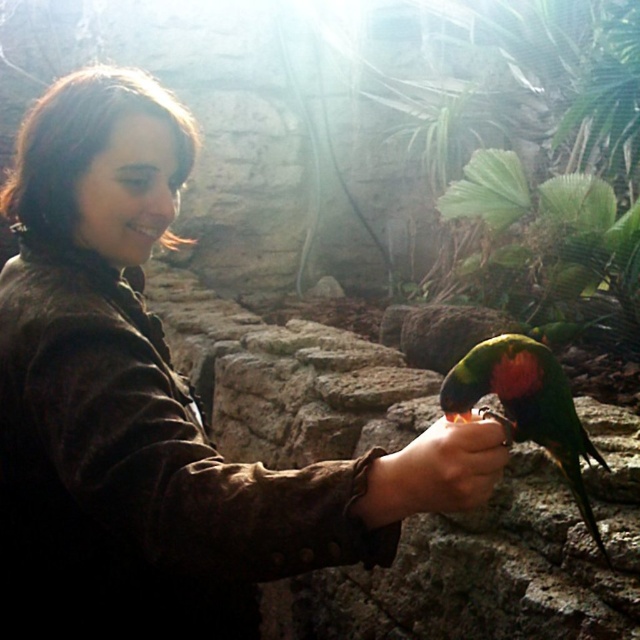
Question: Which of the following is the farthest from the observer?

Choices:
 (A) (513, 440)
 (B) (209, 636)

Answer: (A)

Question: Which object is positioned closest to the brown suede jacket at center?

Choices:
 (A) brown suede hand at center
 (B) multicolored feathered parrot at center

Answer: (A)

Question: Which of the following is the closest to the observer?

Choices:
 (A) (554, 442)
 (B) (477, 435)

Answer: (B)

Question: Is brown suede jacket at center smaller than brown suede hand at center?

Choices:
 (A) no
 (B) yes

Answer: (A)

Question: Does multicolored feathered parrot at center appear on the left side of brown suede hand at center?

Choices:
 (A) yes
 (B) no

Answer: (B)

Question: Is brown suede jacket at center positioned before multicolored feathered parrot at center?

Choices:
 (A) no
 (B) yes

Answer: (B)